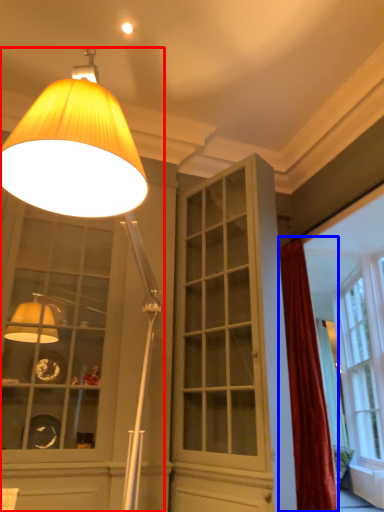
Question: Which object is closer to the camera taking this photo, lamp (highlighted by a red box) or curtain (highlighted by a blue box)?

Choices:
 (A) lamp
 (B) curtain

Answer: (A)